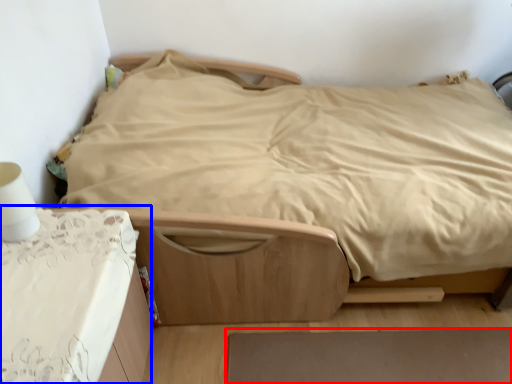
Question: Among these objects, which one is farthest to the camera, plain (highlighted by a red box) or table (highlighted by a blue box)?

Choices:
 (A) plain
 (B) table

Answer: (A)